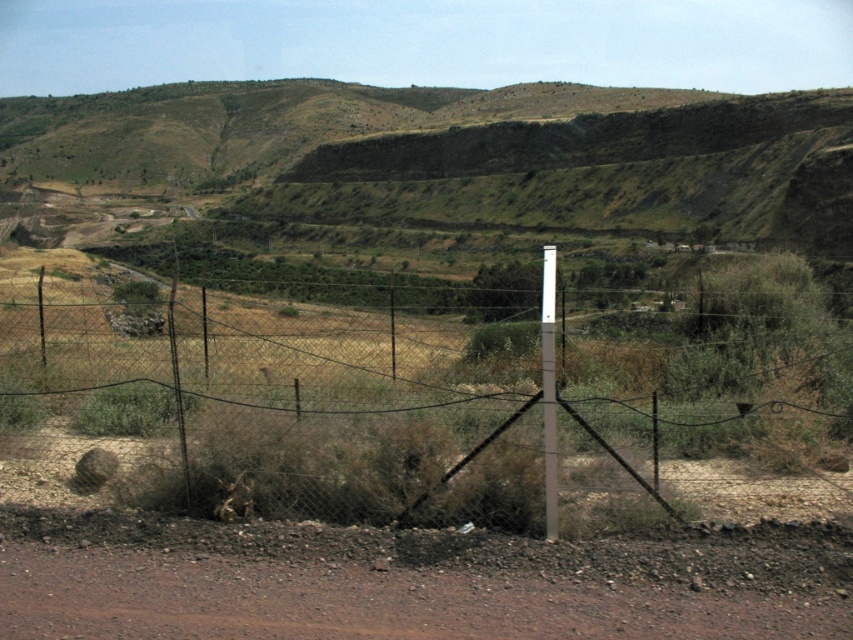
You are a hiker trying to cross the wire mesh fence at center and the brown gravel dirt track at lower center. Which one is taller?

The wire mesh fence at center is much taller than the brown gravel dirt track at lower center.

You are standing in the rural landscape and want to walk along the brown gravel dirt track at lower center. To avoid the wire mesh fence at center, which direction should you move relative to the track?

The wire mesh fence at center is further to the viewer than the brown gravel dirt track at lower center. To avoid the fence, you should move forward along the track towards the direction where the track is closer to you, away from the fence.